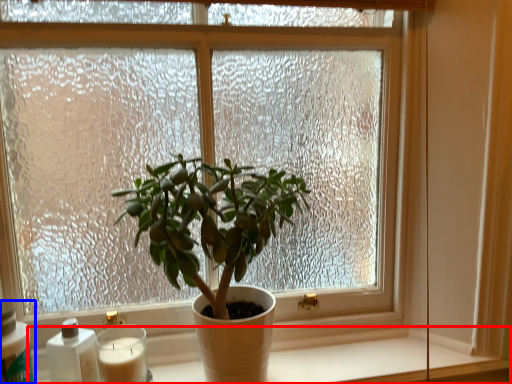
Question: Among these objects, which one is nearest to the camera, window sill (highlighted by a red box) or bottle (highlighted by a blue box)?

Choices:
 (A) window sill
 (B) bottle

Answer: (B)